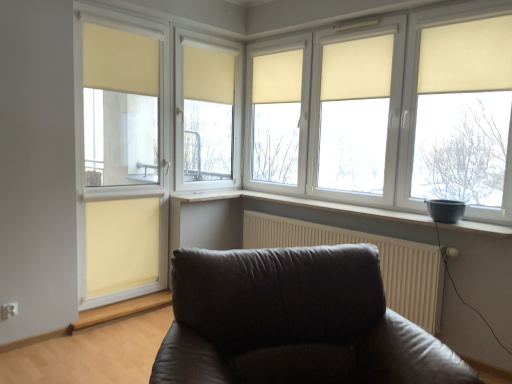
Identify the location of vacant space situated above white plastic window at upper right (from a real-world perspective). (374, 18).